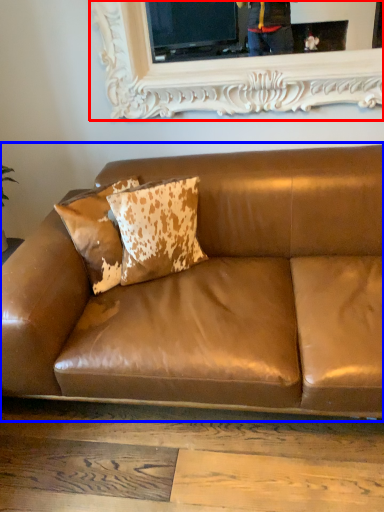
Question: Among these objects, which one is farthest to the camera, picture frame (highlighted by a red box) or studio couch (highlighted by a blue box)?

Choices:
 (A) picture frame
 (B) studio couch

Answer: (A)